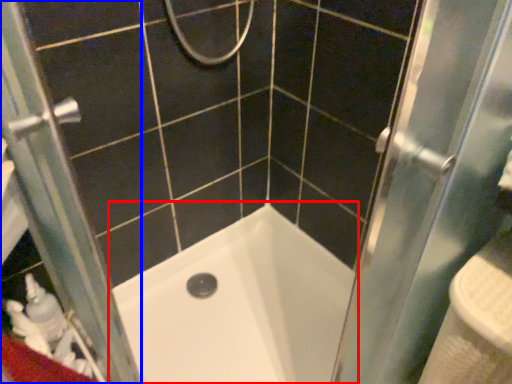
Question: Which point is further to the camera, bathtub (highlighted by a red box) or screen door (highlighted by a blue box)?

Choices:
 (A) bathtub
 (B) screen door

Answer: (A)